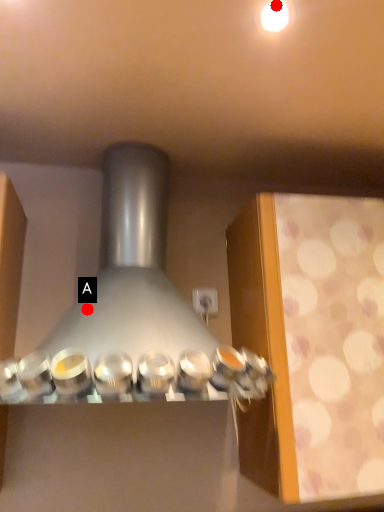
Question: Two points are circled on the image, labeled by A and B beside each circle. Which point is closer to the camera?

Choices:
 (A) A is closer
 (B) B is closer

Answer: (B)